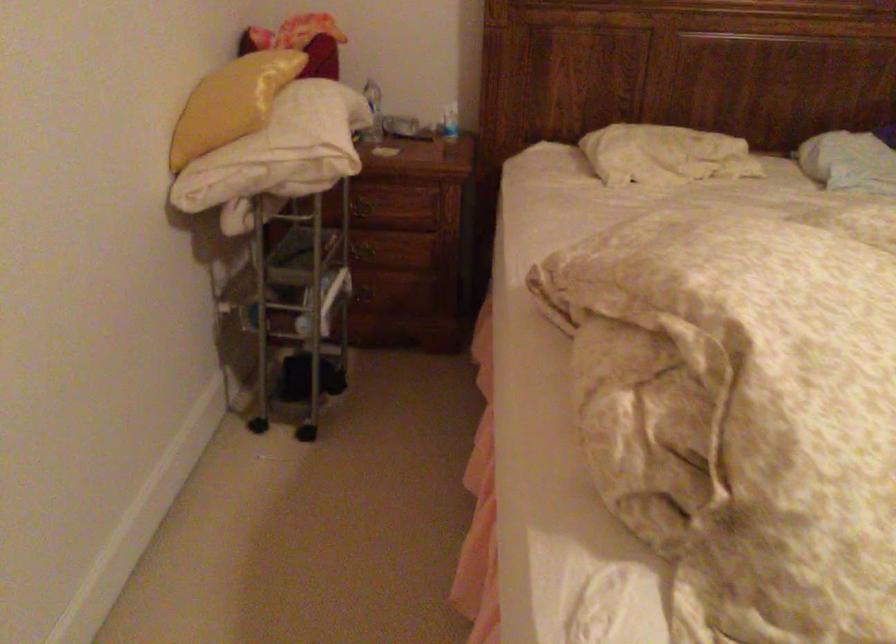
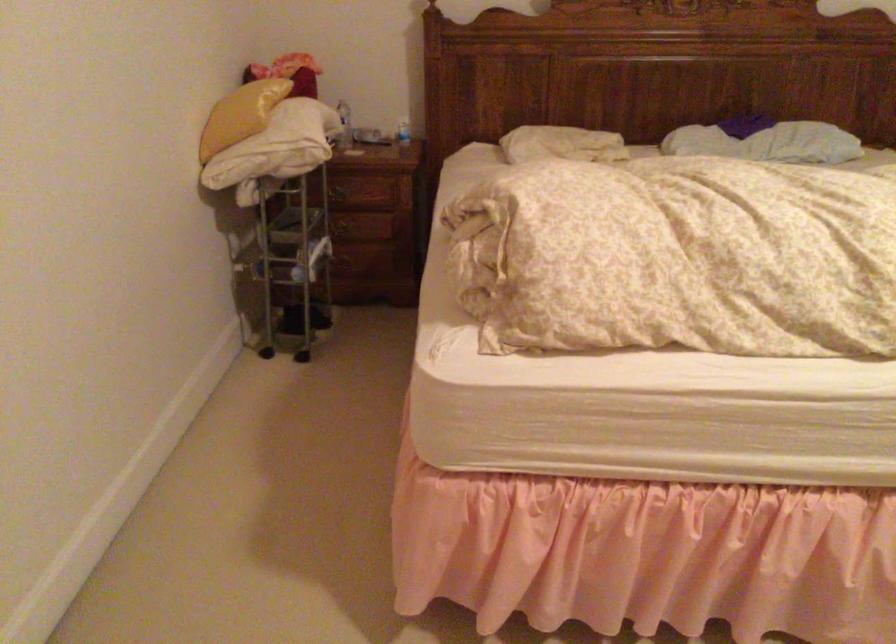
The point at [362,257] is marked in the first image. Where is the corresponding point in the second image?

(342, 230)